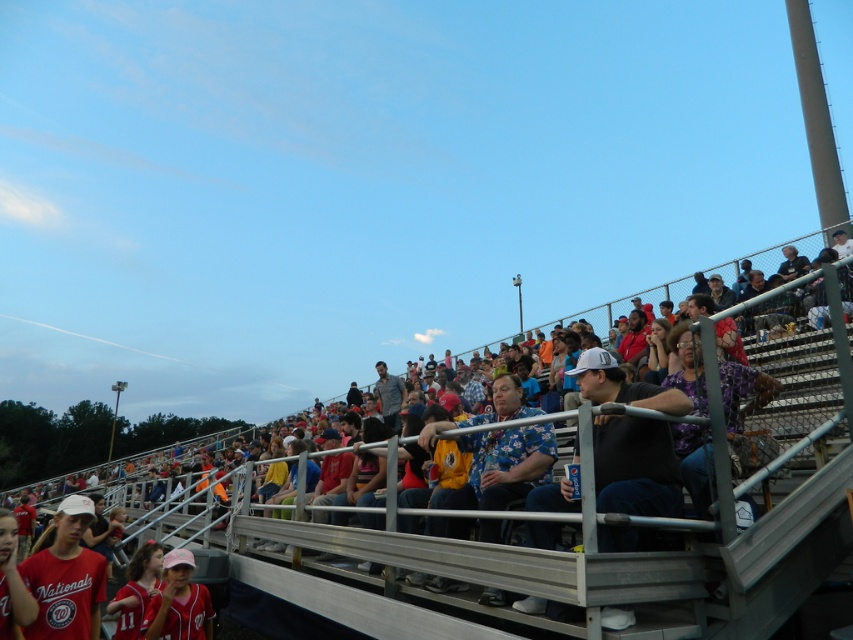
Question: Considering the real-world distances, which object is farthest from the matte pink cap at lower center?

Choices:
 (A) matte red jersey at lower left
 (B) blue fabric seats at center

Answer: (B)

Question: Does blue fabric seats at center have a larger size compared to matte pink cap at lower center?

Choices:
 (A) yes
 (B) no

Answer: (A)

Question: Which point is closer to the camera taking this photo?

Choices:
 (A) (828, 483)
 (B) (42, 620)
 (C) (206, 611)

Answer: (A)

Question: Is blue fabric seats at center thinner than matte pink cap at lower center?

Choices:
 (A) yes
 (B) no

Answer: (B)

Question: Is matte red jersey at lower left behind matte pink cap at lower center?

Choices:
 (A) no
 (B) yes

Answer: (A)

Question: Which point is farther from the camera taking this photo?

Choices:
 (A) (187, 620)
 (B) (71, 628)
 (C) (611, 582)

Answer: (A)